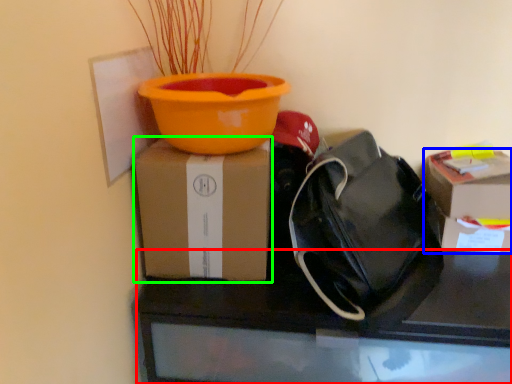
Question: Which object is the farthest from desk (highlighted by a red box)? Choose among these: box (highlighted by a blue box) or box (highlighted by a green box).

Choices:
 (A) box
 (B) box

Answer: (A)